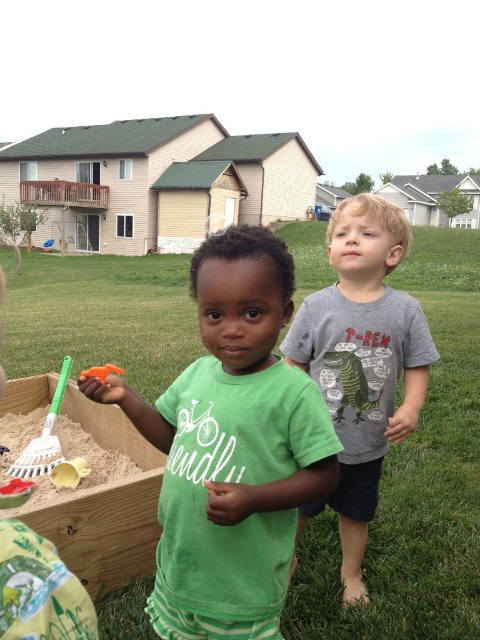
Does green matte shirt at center come in front of smooth yellow sand at lower left?

Yes, green matte shirt at center is closer to the viewer.

Based on the photo, does green matte shirt at center appear on the right side of smooth yellow sand at lower left?

Yes, green matte shirt at center is to the right of smooth yellow sand at lower left.

Is point (216, 358) positioned after point (58, 499)?

No, it is not.

Find the location of a particular element. This screenshot has width=480, height=640. green matte shirt at center is located at coordinates (231, 449).

Does gray cotton t-shirt at center appear over orange plastic shovel at lower left?

Yes, gray cotton t-shirt at center is above orange plastic shovel at lower left.

Which is more to the right, gray cotton t-shirt at center or orange plastic shovel at lower left?

gray cotton t-shirt at center

Is point (347, 273) farther from viewer compared to point (121, 371)?

That is True.

Find the location of a particular element. The image size is (480, 640). gray cotton t-shirt at center is located at coordinates (361, 364).

What do you see at coordinates (231, 449) in the screenshot? I see `green matte shirt at center` at bounding box center [231, 449].

Image resolution: width=480 pixels, height=640 pixels. Describe the element at coordinates (231, 449) in the screenshot. I see `green matte shirt at center` at that location.

Locate an element on the screen. green matte shirt at center is located at coordinates (231, 449).